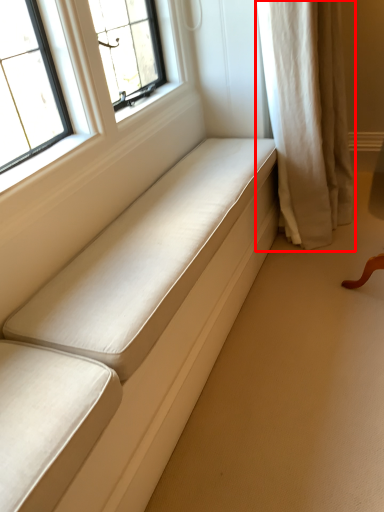
Question: From the image's perspective, considering the relative positions of curtain (annotated by the red box) and furniture in the image provided, where is curtain (annotated by the red box) located with respect to the staircase?

Choices:
 (A) below
 (B) above

Answer: (B)